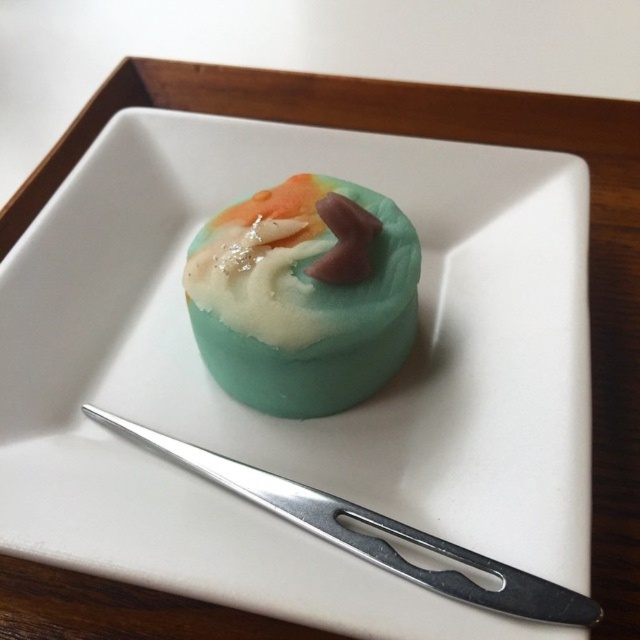
Measure the distance from silver metallic knife at center to semi-sweet chocolate frosting at center.

silver metallic knife at center and semi-sweet chocolate frosting at center are 29.86 centimeters apart.

Does silver metallic knife at center appear over semi-sweet chocolate frosting at center?

No.

Between point (387, 563) and point (202, 259), which one is positioned in front?

Point (387, 563) is more forward.

The image size is (640, 640). What are the coordinates of `silver metallic knife at center` in the screenshot? It's located at (371, 536).

Does matte teal cake at center have a smaller size compared to silver metallic knife at center?

Yes, matte teal cake at center is smaller than silver metallic knife at center.

Can you confirm if matte teal cake at center is positioned to the right of silver metallic knife at center?

No, matte teal cake at center is not to the right of silver metallic knife at center.

Where is `matte teal cake at center`? matte teal cake at center is located at coordinates (305, 296).

At what (x,y) coordinates should I click in order to perform the action: click on matte teal cake at center. Please return your answer as a coordinate pair (x, y). This screenshot has height=640, width=640. Looking at the image, I should click on (305, 296).

Between point (244, 388) and point (266, 339), which one is positioned in front?

Point (266, 339) is more forward.

Which is below, matte teal cake at center or semi-sweet chocolate frosting at center?

matte teal cake at center is lower down.

Does point (243, 272) come closer to viewer compared to point (301, 291)?

No, it is behind (301, 291).

At what (x,y) coordinates should I click in order to perform the action: click on matte teal cake at center. Please return your answer as a coordinate pair (x, y). Image resolution: width=640 pixels, height=640 pixels. Looking at the image, I should click on (305, 296).